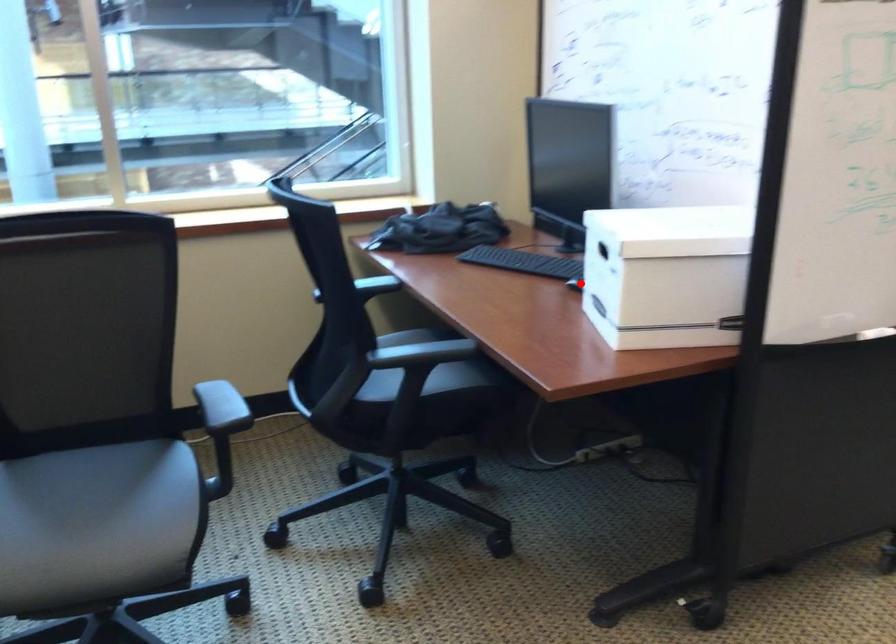
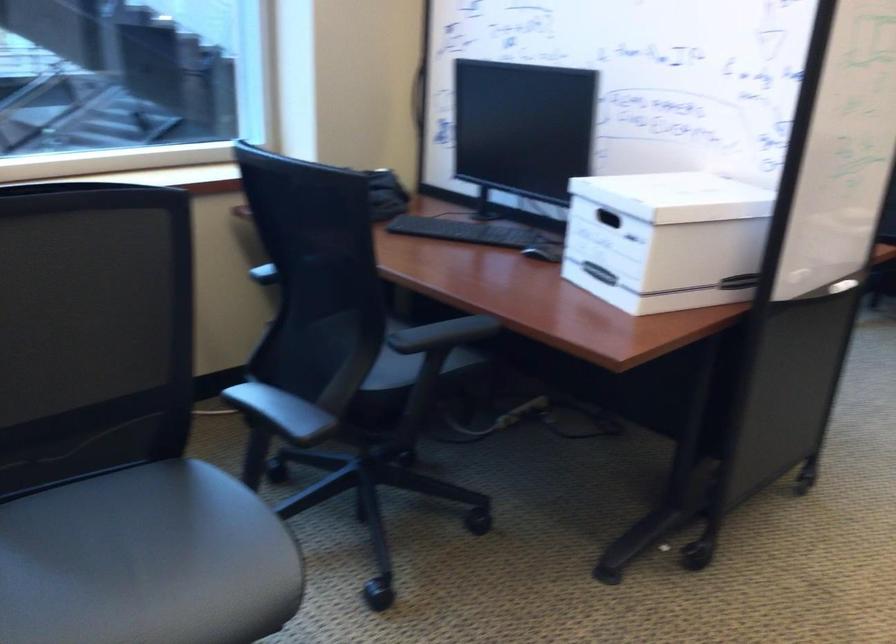
In the second image, find the point that corresponds to the highlighted location in the first image.

(544, 251)